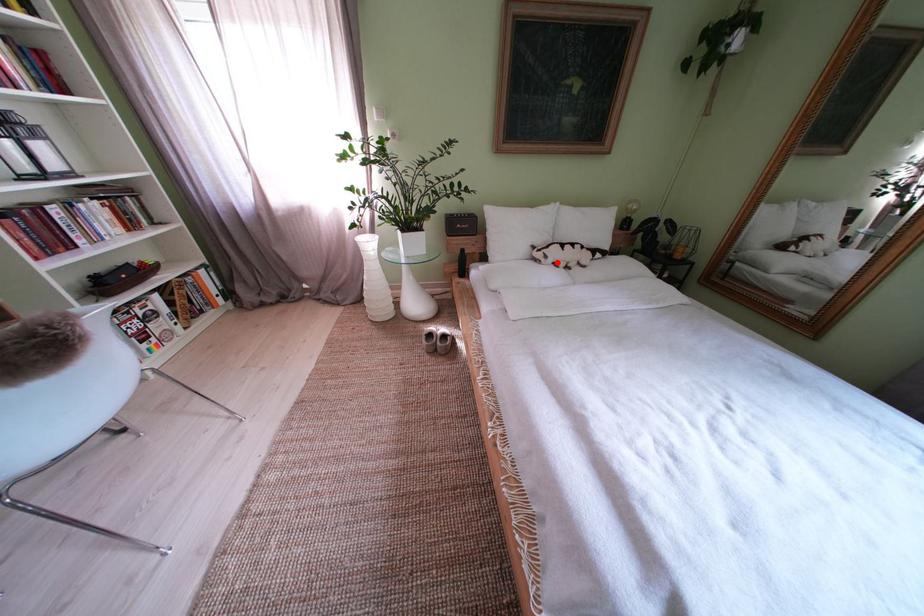
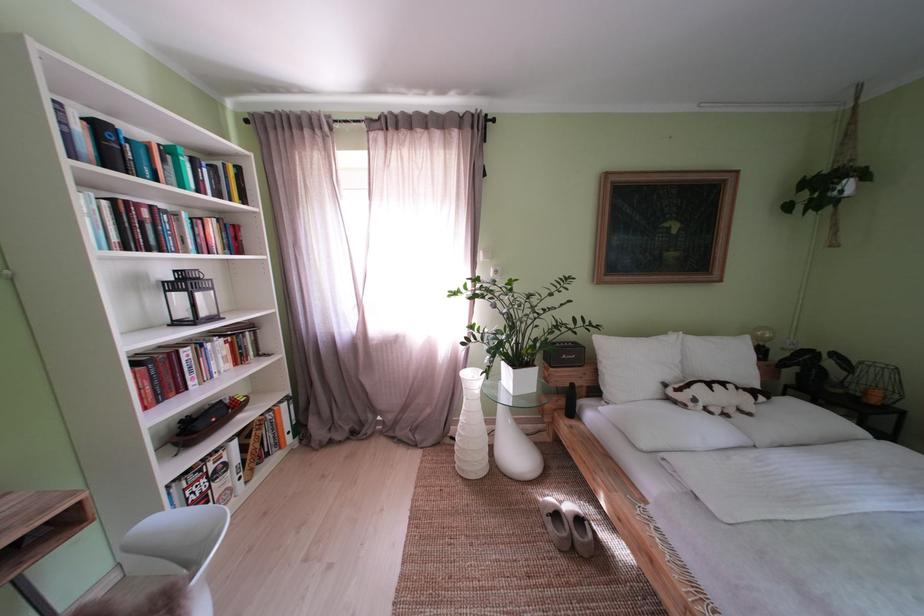
Question: A red point is marked in image1. In image2, is the corresponding 3D point closer to the camera or farther? Reply with the corresponding letter.

Choices:
 (A) The corresponding 3D point is closer.
 (B) The corresponding 3D point is farther.

Answer: (B)